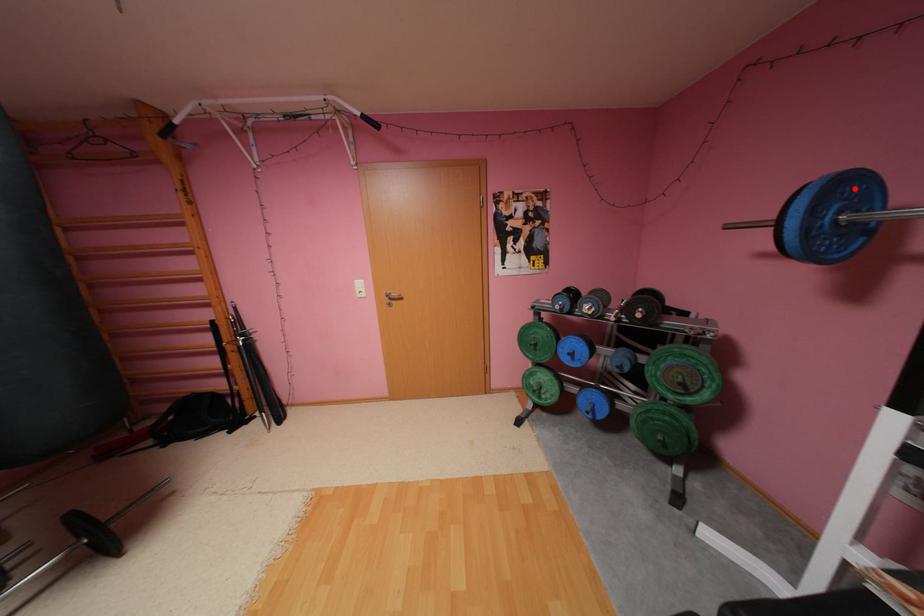
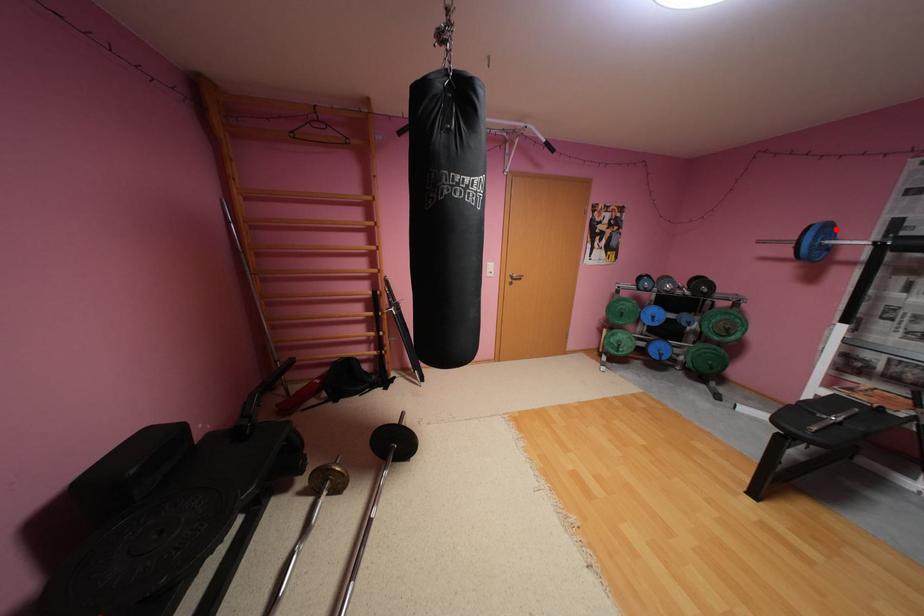
I am providing you with two images of the same scene from different viewpoints. A red point is marked on the first image and another point is marked on the second image. Are the points marked in image1 and image2 representing the same 3D position?

Yes